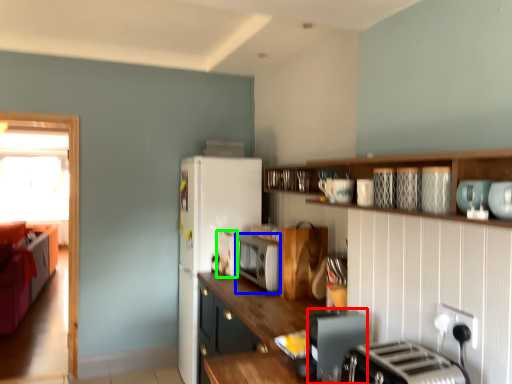
Question: Which object is positioned farthest from appliance (highlighted by a red box)? Select from appliance (highlighted by a blue box) and appliance (highlighted by a green box).

Choices:
 (A) appliance
 (B) appliance

Answer: (B)